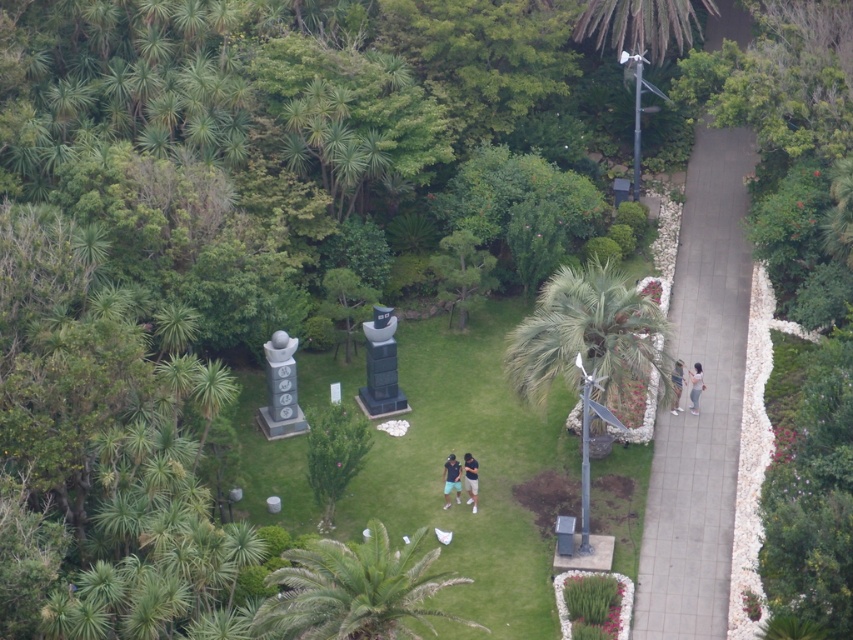
Question: Does green leafy palm tree at center-right have a greater width compared to light brown fabric pants at right?

Choices:
 (A) no
 (B) yes

Answer: (B)

Question: Is green leafy palm tree at center bigger than dark blue jeans at center?

Choices:
 (A) yes
 (B) no

Answer: (B)

Question: Among these points, which one is farthest from the camera?

Choices:
 (A) (372, 547)
 (B) (590, 317)
 (C) (302, 419)
 (D) (466, 500)

Answer: (C)

Question: Which of the following is the closest to the observer?

Choices:
 (A) (699, 385)
 (B) (543, 387)
 (C) (474, 435)
 (D) (283, 432)

Answer: (B)

Question: Which point appears closest to the camera in this image?

Choices:
 (A) (572, 378)
 (B) (442, 472)

Answer: (A)

Question: Can you confirm if green leafy palm tree at center-right is wider than light brown fabric pants at right?

Choices:
 (A) yes
 (B) no

Answer: (A)